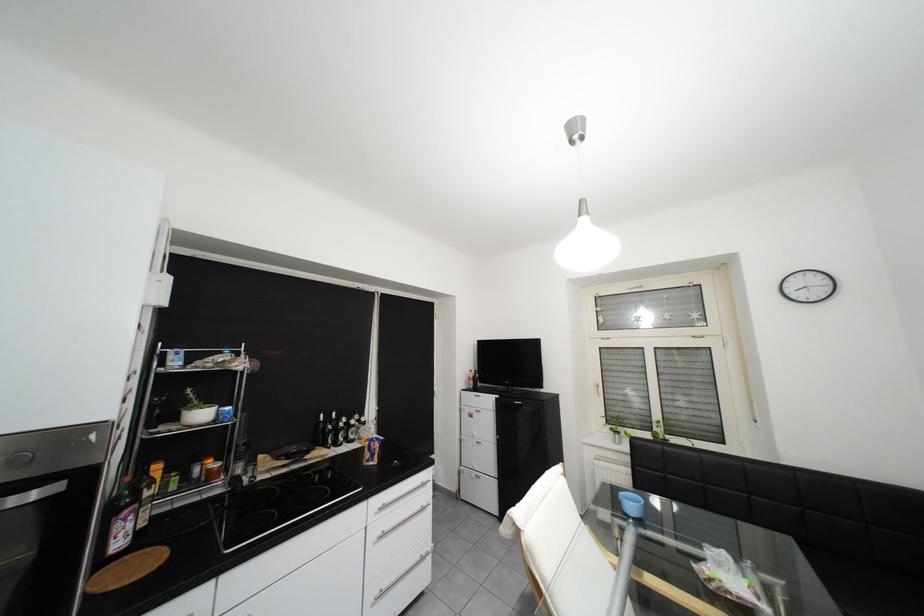
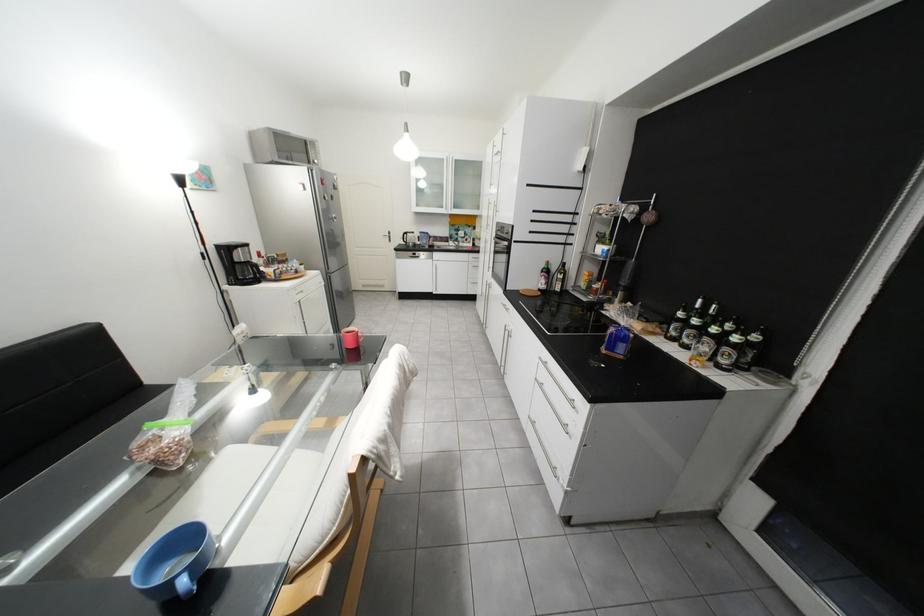
Where in the second image is the point corresponding to point (186, 488) from the first image?

(596, 288)